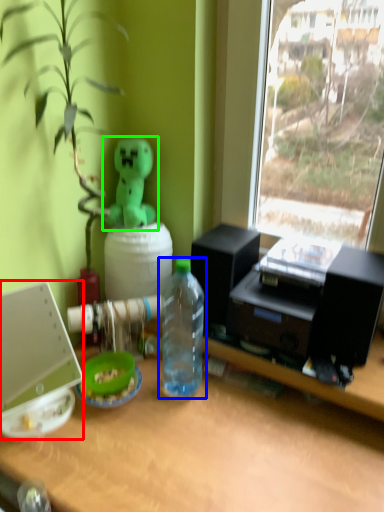
Question: Considering the real-world distances, which object is closest to laptop (highlighted by a red box)? bottle (highlighted by a blue box) or toy (highlighted by a green box).

Choices:
 (A) bottle
 (B) toy

Answer: (A)